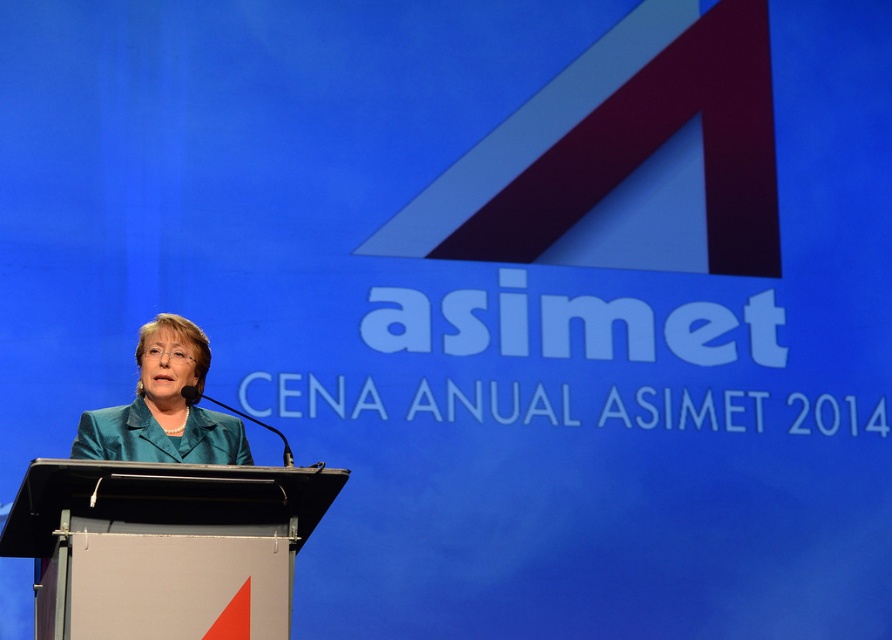
From the picture: You are attending the ASIMET annual dinner and need to present a document on the podium. The document requires a surface area of 0.5 square meters. Can the metallic gray podium at center accommodate this document based on its size compared to the teal fabric jacket at center?

The metallic gray podium at center is larger in size than the teal fabric jacket at center. Since the podium is larger, it likely has sufficient surface area to accommodate a document requiring 0.5 square meters.

You are attending the ASIMET annual event and notice two points marked in the image. From your perspective, which point is closer to you, point (192, 522) or point (200, 440)?

Point (192, 522) is closer to the viewer than point (200, 440).

You are an event organizer who needs to ensure that the teal fabric jacket at center can be placed on the metallic gray podium at center without exceeding its edges. Based on the provided information, will the jacket fit on the podium?

The metallic gray podium at center is wider than the teal fabric jacket at center, so the jacket can be placed on the podium without exceeding its edges.